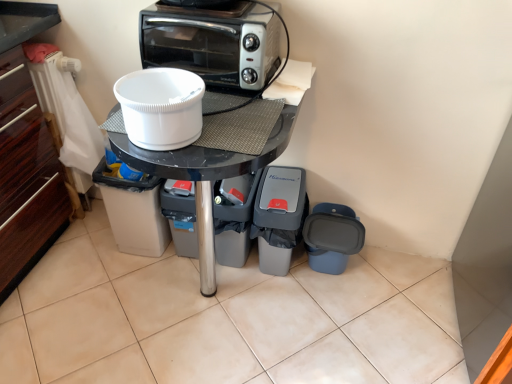
Where is `vacant space situated on the left part of black glossy table at center`? vacant space situated on the left part of black glossy table at center is located at coordinates (81, 294).